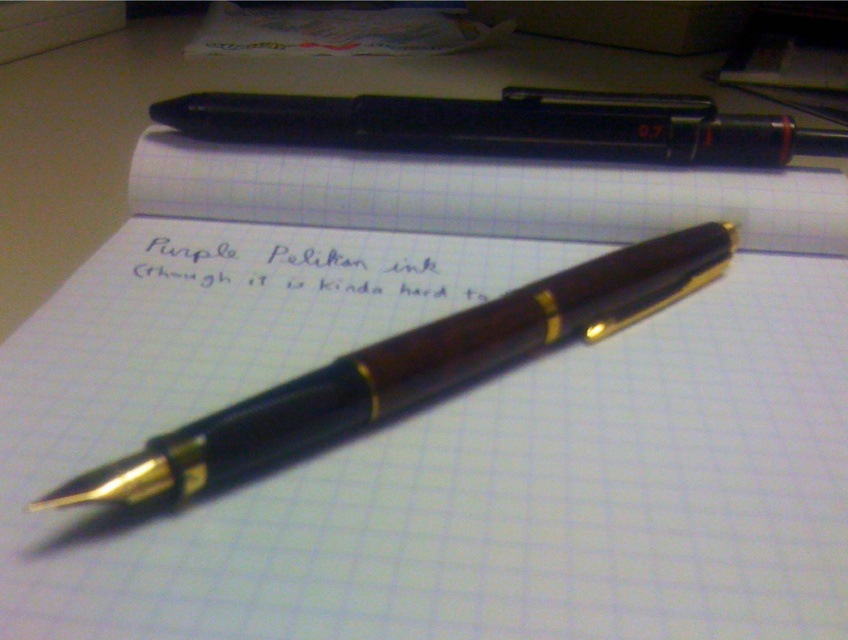
You are an artist trying to draw the wooden pen at center and the matte black pen at upper center. Which pen should you sketch first if you want to follow the correct layering order based on their positions?

You should sketch the wooden pen at center first because it is closer to the viewer than the matte black pen at upper center, so it should appear layered in front.

You are an artist drawing on the graph paper. You have two points to connect for a line segment. The first point is point (506, 109) and the second is point (154, 257). Which point should you start drawing from if you want the line to appear closer to the viewer?

You should start drawing from point (154, 257) because it is closer to the viewer than point (506, 109), so starting there will make the line appear closer.